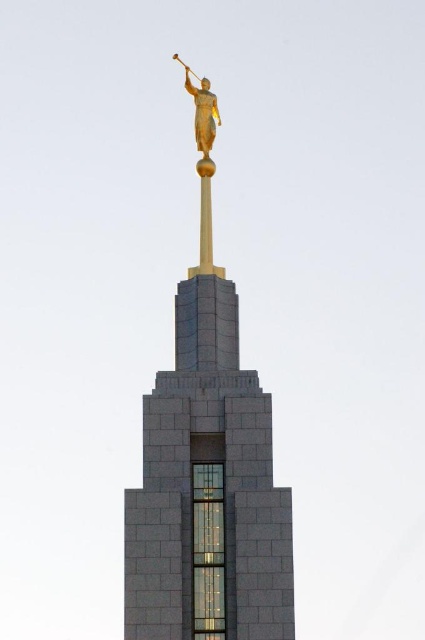
You are standing at the base of the building and looking up. There is a point marked at coordinates (206, 467) on the building. What object is located at that point?

The gold polished statue at upper center is located at point (206, 467).